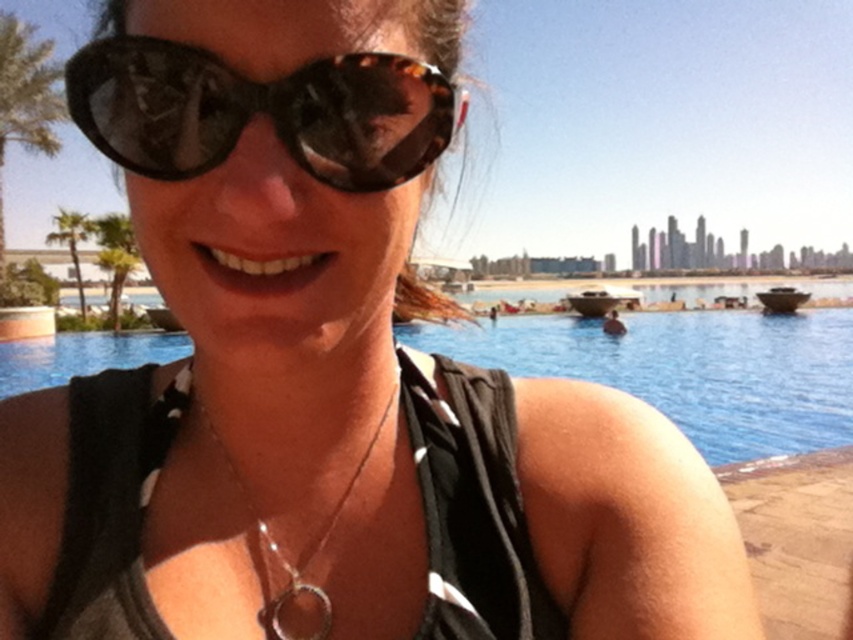
You are a photographer trying to capture the reflection of the blue glass swimming pool at center in the tortoiseshell sunglasses at center. Based on their relative heights, can the sunglasses reflect the entire pool?

The blue glass swimming pool at center is taller than the tortoiseshell sunglasses at center, so the sunglasses cannot reflect the entire pool due to its smaller height.

You are a photographer trying to capture a close shot of the tortoiseshell sunglasses at center and the silver metallic necklace at center. Since you want to focus on the sunglasses, which object should you adjust your camera to prioritize in terms of size in the frame?

The tortoiseshell sunglasses at center should be prioritized as they are wider than the silver metallic necklace at center, making them naturally larger in the frame.

Looking at this image, you are a photographer trying to focus on the tortoiseshell sunglasses at center. You notice a point at coordinates (260,112). Is this point located on the sunglasses?

Yes, the point at coordinates (260,112) is located on the tortoiseshell sunglasses at center as stated in the description.